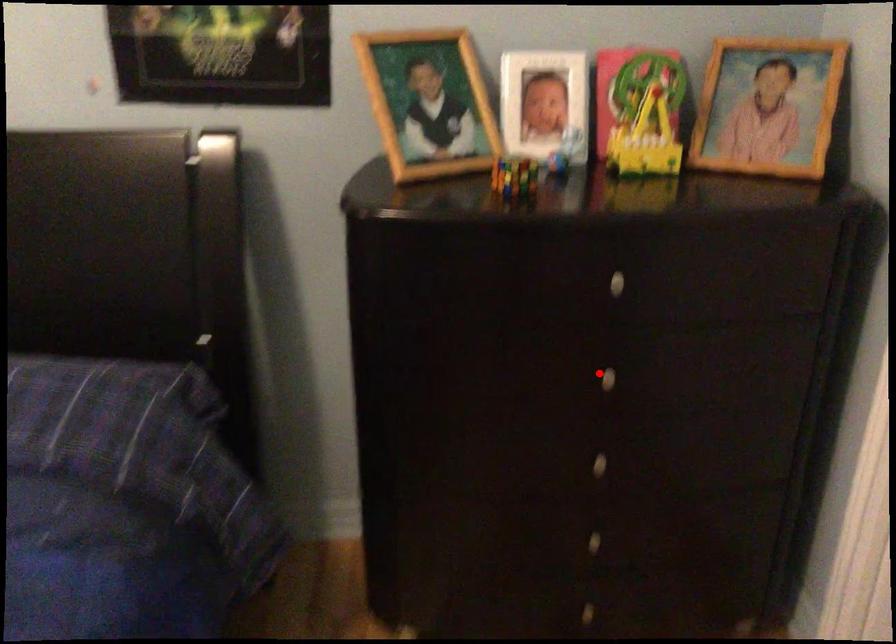
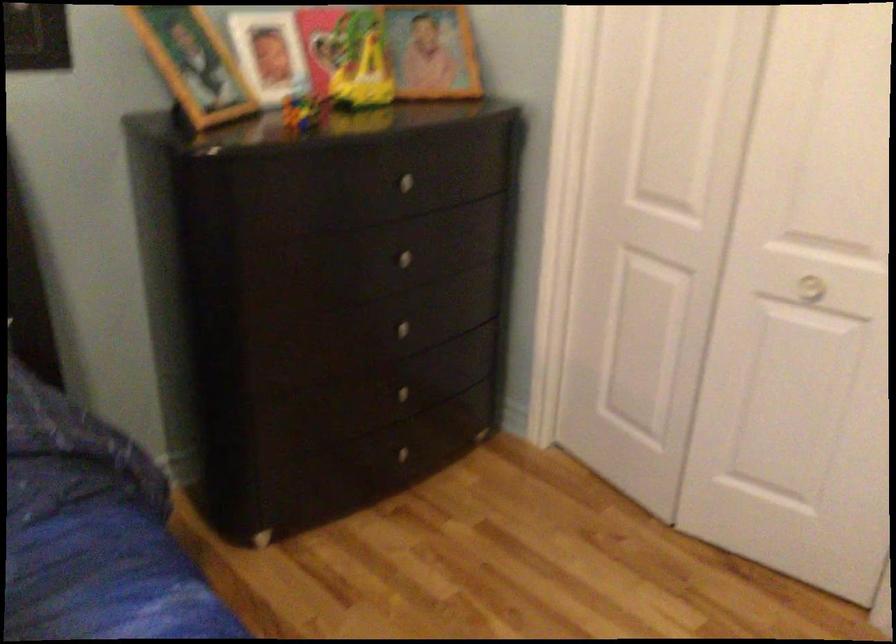
Find the pixel in the second image that matches the highlighted location in the first image.

(399, 258)